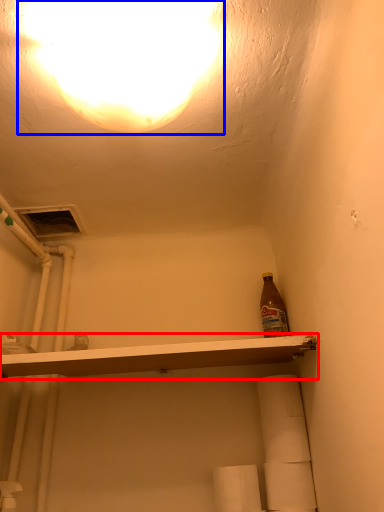
Question: Which point is further to the camera, shelf (highlighted by a red box) or light (highlighted by a blue box)?

Choices:
 (A) shelf
 (B) light

Answer: (A)